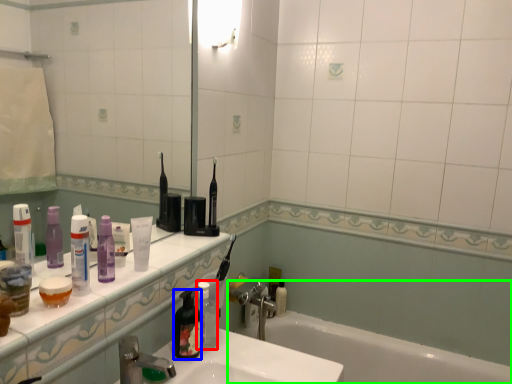
Question: Based on their relative distances, which object is nearer to toiletry (highlighted by a red box)? Choose from toiletry (highlighted by a blue box) and bathtub (highlighted by a green box).

Choices:
 (A) toiletry
 (B) bathtub

Answer: (A)